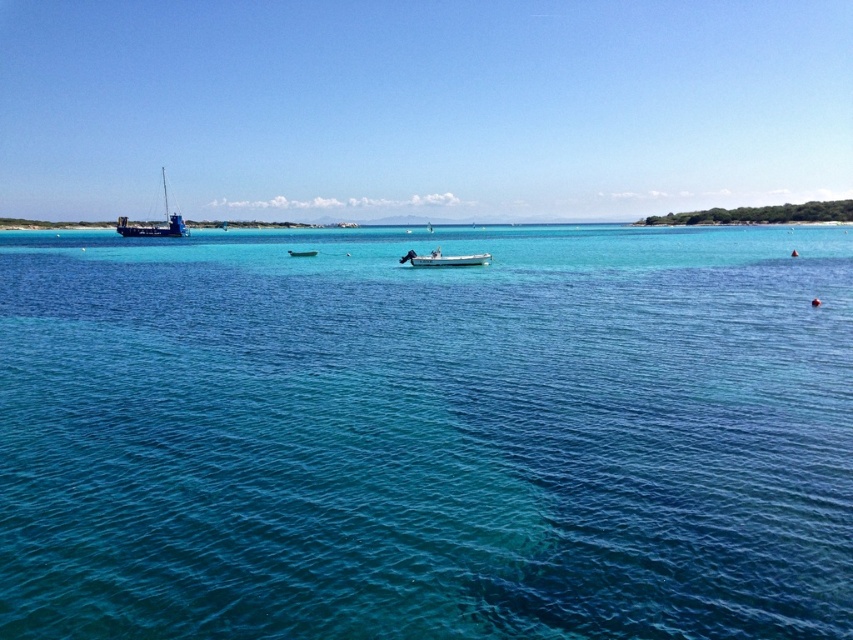
You are standing on the shore and see the clear blue water at center and the white plastic boat at center. Which object is closer to the horizon?

The white plastic boat at center is closer to the horizon because the clear blue water at center is above it, meaning the boat is positioned further back in the scene.

From the picture: You are navigating a small boat and need to avoid shallow areas. According to the coordinates provided, where is the clear blue water at center located?

The clear blue water at center is located at point coordinates of (426,433), which indicates its position in the scene.